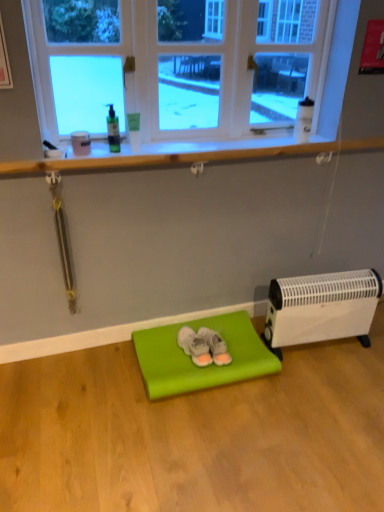
Describe the element at coordinates (194, 346) in the screenshot. This screenshot has height=512, width=384. I see `gray suede slippers at center, acting as the 1th footwear starting from the left` at that location.

Describe the element at coordinates (198, 59) in the screenshot. The image size is (384, 512). I see `clear glass window at upper center` at that location.

Measure the distance between point [168,391] and camera.

Point [168,391] and camera are 6.00 feet apart from each other.

You are a GUI agent. You are given a task and a screenshot of the screen. Output one action in this format:
    pyautogui.click(x=<x>, y=<y>)
    Task: Click on the matte green yoga mat at center
    
    Given the screenshot: What is the action you would take?
    (x=191, y=361)

In order to click on gray suede slippers at center, acting as the 1th footwear starting from the left in this screenshot , I will do `click(194, 346)`.

Between gray suede slippers at center, acting as the 2th footwear starting from the right, and white suede sneakers at center, the second footwear in the left-to-right sequence, which one has larger size?

gray suede slippers at center, acting as the 2th footwear starting from the right.

Is gray suede slippers at center, acting as the 2th footwear starting from the right, oriented away from white suede sneakers at center, which is the 1th footwear in right-to-left order?

No, white suede sneakers at center, which is the 1th footwear in right-to-left order, is not at the back of gray suede slippers at center, acting as the 2th footwear starting from the right.

Is gray suede slippers at center, acting as the 1th footwear starting from the left, inside the boundaries of white suede sneakers at center, which is the 1th footwear in right-to-left order, or outside?

gray suede slippers at center, acting as the 1th footwear starting from the left, exists outside the volume of white suede sneakers at center, which is the 1th footwear in right-to-left order.

From the picture: Between gray suede slippers at center, acting as the 2th footwear starting from the right, and clear glass window at upper center, which one has smaller size?

gray suede slippers at center, acting as the 2th footwear starting from the right, is smaller.

Does gray suede slippers at center, acting as the 2th footwear starting from the right, lie in front of clear glass window at upper center?

No, gray suede slippers at center, acting as the 2th footwear starting from the right, is further to the viewer.

Where is `window in front of the gray suede slippers at center, acting as the 1th footwear starting from the left`? This screenshot has height=512, width=384. window in front of the gray suede slippers at center, acting as the 1th footwear starting from the left is located at coordinates (198, 59).

From the image's perspective, which one is positioned lower, white suede sneakers at center, which is the 1th footwear in right-to-left order, or gray suede slippers at center, acting as the 2th footwear starting from the right?

gray suede slippers at center, acting as the 2th footwear starting from the right.

Can you tell me how much white suede sneakers at center, the second footwear in the left-to-right sequence, and gray suede slippers at center, acting as the 2th footwear starting from the right, differ in facing direction?

There is a 0.000178-degree angle between the facing directions of white suede sneakers at center, the second footwear in the left-to-right sequence, and gray suede slippers at center, acting as the 2th footwear starting from the right.

Which of these two, white suede sneakers at center, the second footwear in the left-to-right sequence, or gray suede slippers at center, acting as the 1th footwear starting from the left, stands shorter?

With less height is gray suede slippers at center, acting as the 1th footwear starting from the left.

Looking at their sizes, would you say white suede sneakers at center, which is the 1th footwear in right-to-left order, is wider or thinner than gray suede slippers at center, acting as the 1th footwear starting from the left?

Clearly, white suede sneakers at center, which is the 1th footwear in right-to-left order, has less width compared to gray suede slippers at center, acting as the 1th footwear starting from the left.

From the picture: Considering the relative sizes of white suede sneakers at center, the second footwear in the left-to-right sequence, and matte green yoga mat at center in the image provided, is white suede sneakers at center, the second footwear in the left-to-right sequence, bigger than matte green yoga mat at center?

No.

Which is in front, point (219, 344) or point (140, 359)?

Positioned in front is point (140, 359).

Consider the image. What's the angular difference between white suede sneakers at center, the second footwear in the left-to-right sequence, and matte green yoga mat at center's facing directions?

white suede sneakers at center, the second footwear in the left-to-right sequence, and matte green yoga mat at center are facing 7.15 degrees away from each other.

From a real-world perspective, is white suede sneakers at center, the second footwear in the left-to-right sequence, above or below matte green yoga mat at center?

Clearly, from a real-world perspective, white suede sneakers at center, the second footwear in the left-to-right sequence, is above matte green yoga mat at center.

Which object is positioned more to the right, matte green yoga mat at center or white plastic heater at lower right?

white plastic heater at lower right is more to the right.

Does point (193, 327) appear closer or farther from the camera than point (364, 278)?

Point (193, 327) is positioned farther from the camera compared to point (364, 278).

Is matte green yoga mat at center facing away from white plastic heater at lower right?

No, matte green yoga mat at center is not facing away from white plastic heater at lower right.

In the scene shown: Who is smaller, matte green yoga mat at center or white plastic heater at lower right?

Smaller between the two is matte green yoga mat at center.

Are clear glass window at upper center and white plastic heater at lower right beside each other?

No, clear glass window at upper center is not touching white plastic heater at lower right.

Is clear glass window at upper center inside the boundaries of white plastic heater at lower right, or outside?

clear glass window at upper center is spatially situated outside white plastic heater at lower right.

Is point (65, 46) in front of point (303, 283)?

That is True.

How much distance is there between white plastic heater at lower right and white suede sneakers at center, which is the 1th footwear in right-to-left order?

white plastic heater at lower right is 19.15 inches away from white suede sneakers at center, which is the 1th footwear in right-to-left order.

Are white plastic heater at lower right and white suede sneakers at center, which is the 1th footwear in right-to-left order, beside each other?

No, white plastic heater at lower right is not making contact with white suede sneakers at center, which is the 1th footwear in right-to-left order.

Which footwear is the 2nd one when counting from the back of the white plastic heater at lower right? Please provide its 2D coordinates.

[(215, 346)]

Which of these two, white plastic heater at lower right or white suede sneakers at center, which is the 1th footwear in right-to-left order, is thinner?

white plastic heater at lower right.

The width and height of the screenshot is (384, 512). I want to click on footwear on the right of gray suede slippers at center, acting as the 1th footwear starting from the left, so click(215, 346).

The height and width of the screenshot is (512, 384). What are the coordinates of `window above the gray suede slippers at center, acting as the 1th footwear starting from the left (from a real-world perspective)` in the screenshot? It's located at [x=198, y=59].

Looking at the image, which one is located closer to clear glass window at upper center, white plastic heater at lower right or matte green yoga mat at center?

white plastic heater at lower right.

In the scene shown: Based on their spatial positions, is white plastic heater at lower right or white suede sneakers at center, which is the 1th footwear in right-to-left order, closer to matte green yoga mat at center?

white suede sneakers at center, which is the 1th footwear in right-to-left order, is closer to matte green yoga mat at center.

Based on their spatial positions, is clear glass window at upper center or gray suede slippers at center, acting as the 1th footwear starting from the left, closer to white suede sneakers at center, which is the 1th footwear in right-to-left order?

Based on the image, gray suede slippers at center, acting as the 1th footwear starting from the left, appears to be nearer to white suede sneakers at center, which is the 1th footwear in right-to-left order.

Looking at this image, estimate the real-world distances between objects in this image. Which object is closer to gray suede slippers at center, acting as the 1th footwear starting from the left, white plastic heater at lower right or clear glass window at upper center?

The object closer to gray suede slippers at center, acting as the 1th footwear starting from the left, is white plastic heater at lower right.

Based on the photo, looking at the image, which one is located closer to white plastic heater at lower right, gray suede slippers at center, acting as the 2th footwear starting from the right, or white suede sneakers at center, which is the 1th footwear in right-to-left order?

Among the two, white suede sneakers at center, which is the 1th footwear in right-to-left order, is located nearer to white plastic heater at lower right.

From the image, which object appears to be farther from clear glass window at upper center, white suede sneakers at center, the second footwear in the left-to-right sequence, or gray suede slippers at center, acting as the 2th footwear starting from the right?

Based on the image, white suede sneakers at center, the second footwear in the left-to-right sequence, appears to be further to clear glass window at upper center.

When comparing their distances from gray suede slippers at center, acting as the 2th footwear starting from the right, does clear glass window at upper center or white plastic heater at lower right seem closer?

white plastic heater at lower right is positioned closer to the anchor gray suede slippers at center, acting as the 2th footwear starting from the right.

Estimate the real-world distances between objects in this image. Which object is closer to matte green yoga mat at center, gray suede slippers at center, acting as the 1th footwear starting from the left, or white suede sneakers at center, the second footwear in the left-to-right sequence?

gray suede slippers at center, acting as the 1th footwear starting from the left.

Find the location of a particular element. This screenshot has width=384, height=512. footwear located between gray suede slippers at center, acting as the 2th footwear starting from the right, and white plastic heater at lower right in the left-right direction is located at coordinates tap(215, 346).

Identify the location of heater between clear glass window at upper center and gray suede slippers at center, acting as the 1th footwear starting from the left, in the up-down direction. This screenshot has height=512, width=384. coord(321,308).

Locate an element on the screen. heater that lies between clear glass window at upper center and white suede sneakers at center, the second footwear in the left-to-right sequence, from top to bottom is located at coordinates (321, 308).

The height and width of the screenshot is (512, 384). In order to click on footwear between clear glass window at upper center and gray suede slippers at center, acting as the 2th footwear starting from the right, in the up-down direction in this screenshot , I will do `click(215, 346)`.